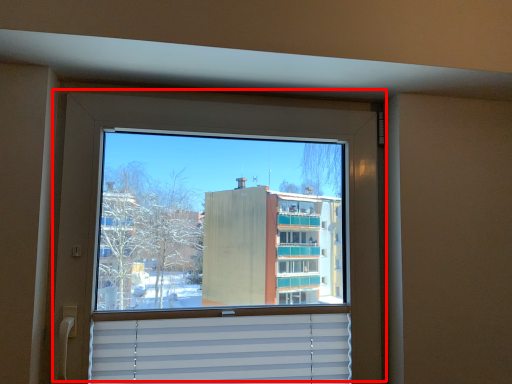
Question: From the image's perspective, what is the correct spatial relationship of window (annotated by the red box) in relation to shutter?

Choices:
 (A) below
 (B) above

Answer: (B)